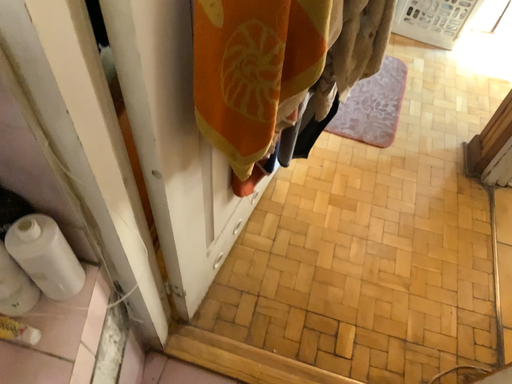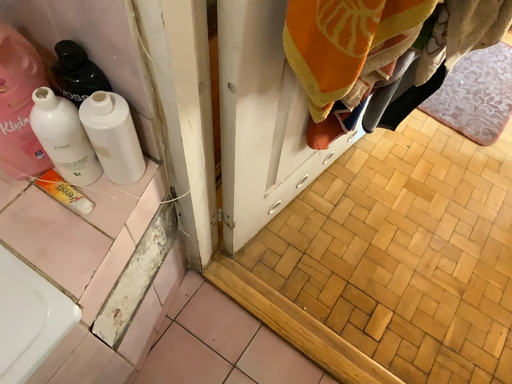
Question: How did the camera likely rotate when shooting the video?

Choices:
 (A) rotated right
 (B) rotated left

Answer: (B)